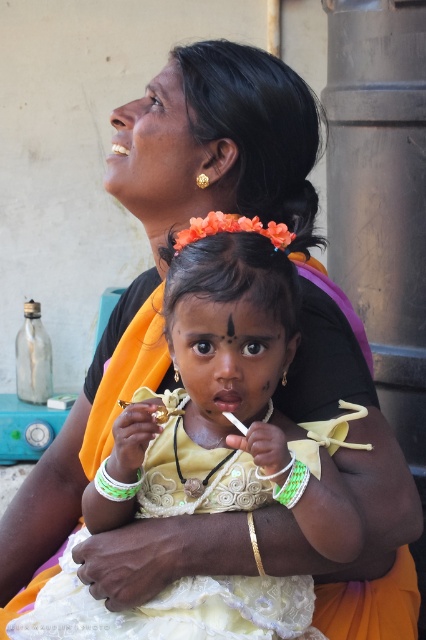
Which is below, matte gold earrings at upper left or black matte forehead at center?

black matte forehead at center

Is matte gold earrings at upper left shorter than black matte forehead at center?

No, matte gold earrings at upper left is not shorter than black matte forehead at center.

The height and width of the screenshot is (640, 426). What are the coordinates of `matte gold earrings at upper left` in the screenshot? It's located at (155, 148).

Can you confirm if matte gold necklace at center is bigger than matte gold earrings at upper left?

No.

Between matte gold necklace at center and matte gold earrings at upper left, which one is positioned higher?

matte gold earrings at upper left

Consider the image. Who is more distant from viewer, (x=219, y=314) or (x=203, y=170)?

The point (x=203, y=170) is behind.

Locate an element on the screen. Image resolution: width=426 pixels, height=640 pixels. matte gold necklace at center is located at coordinates (227, 358).

Can you confirm if matte gold earrings at upper left is wider than white plastic bracelet at lower center?

Correct, the width of matte gold earrings at upper left exceeds that of white plastic bracelet at lower center.

Is point (195, 156) farther from viewer compared to point (132, 483)?

Yes, point (195, 156) is farther from viewer.

Who is more forward, (149, 189) or (109, 486)?

Point (109, 486) is in front.

Identify the location of matte gold earrings at upper left. (155, 148).